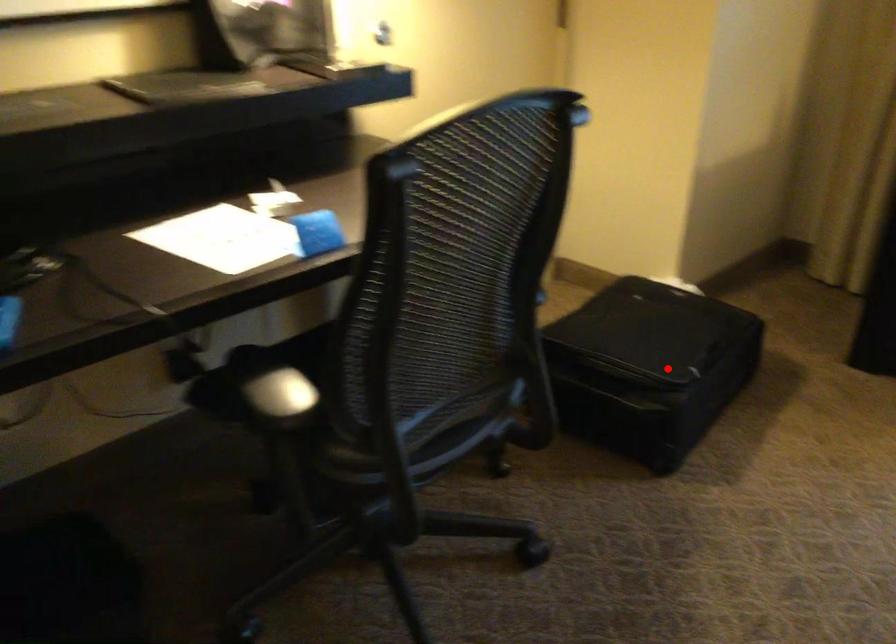
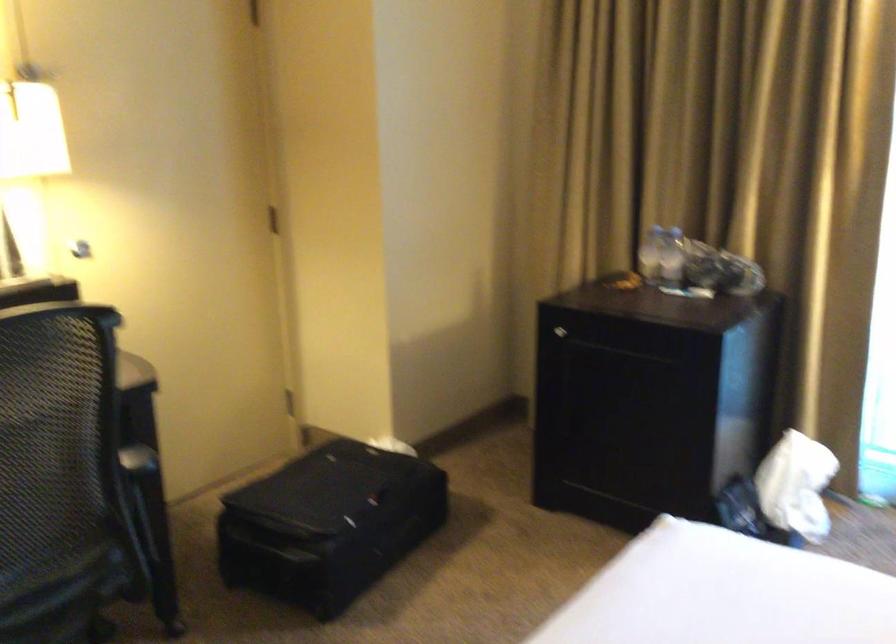
Question: I am providing you with two images of the same scene from different viewpoints. Given a red point in image1, look at the same physical point in image2. Is it:

Choices:
 (A) Closer to the viewpoint
 (B) Farther from the viewpoint

Answer: (B)